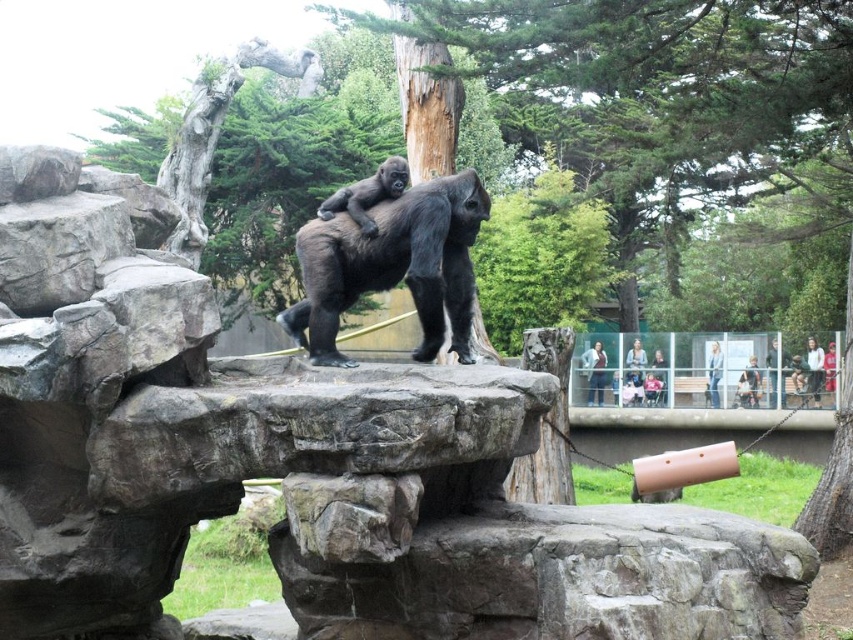
You are a zookeeper observing the gorillas in their enclosure. You notice the shiny black gorilla at center and the black matte gorilla at center. Which gorilla is shorter?

The shiny black gorilla at center is shorter than the black matte gorilla at center.

You are a zookeeper who needs to place a feeding tray between the shiny black gorilla at center and the black matte gorilla at center. The tray requires at least 5 feet of space to be placed safely. Based on the scene, will there be enough space between them?

The shiny black gorilla at center is 5.20 feet from the black matte gorilla at center, so yes, there is enough space to place the feeding tray safely between them as the required 5 feet is met.

You are standing in front of the zoo enclosure and notice a specific point marked at coordinates (393, 266). What animal is located at that point?

The point at coordinates (393, 266) corresponds to the shiny black gorilla at center.